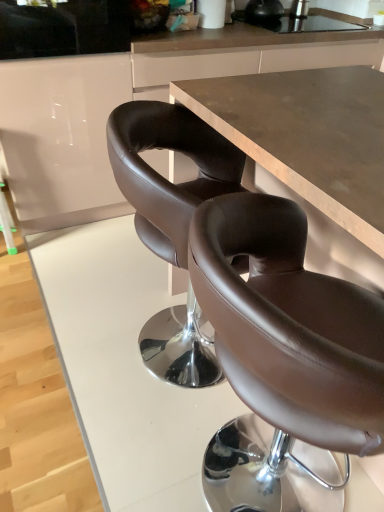
Locate an element on the screen. The height and width of the screenshot is (512, 384). vacant space positioned to the left of brown leather chair at center is located at coordinates (95, 438).